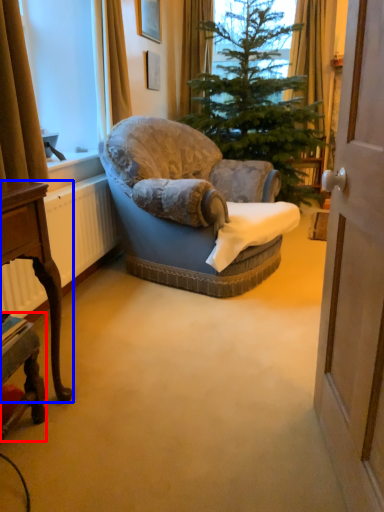
Question: Which point is closer to the camera, desk (highlighted by a red box) or desk (highlighted by a blue box)?

Choices:
 (A) desk
 (B) desk

Answer: (B)